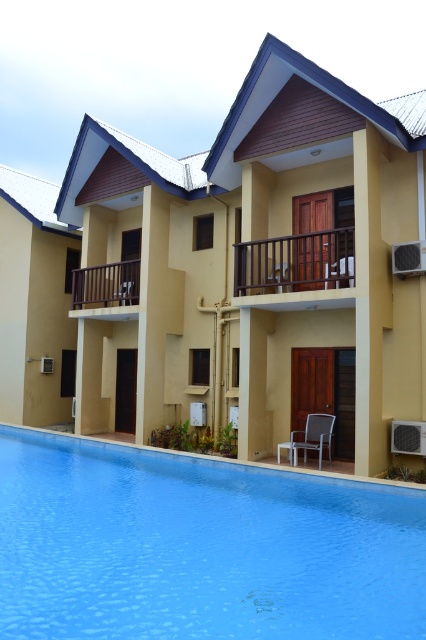
You are an architect designing a new layout for the area. You need to place a new bench that is 2 meters wide between the yellow matte building at center and the metallic gray chair at lower center. Based on their widths, can the bench fit between them without overlapping either structure?

The yellow matte building at center is wider than the metallic gray chair at lower center. However, the exact widths are not provided, so it is impossible to determine if the 2 meter bench can fit between them without overlapping.

Please provide the coordinates of the yellow matte building at center in the image. The coordinate system uses the bottom left corner as the origin point. The answer should be in the format of a point with two decimal places, like this example format point format example point format example point format example point format example point format example point format example point format example point format example point format example point format example point format example point format example point.

The coordinates of the yellow matte building at center are point at point at point at point at point at point at point at point at point at point at point at point at point at point at point at point at point at point at point at point at point at point at point at point at point at point at point at point at point at point at point at point at point at point at point at point at point at point at point at point at point at point at point at point at point at point at point at point at point at point at 0.4